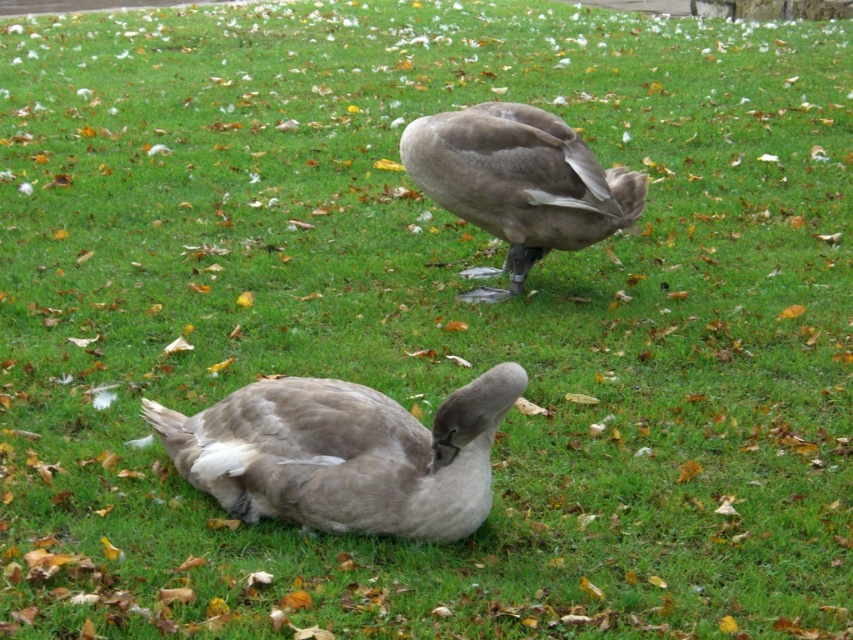
Does point (434, 493) come closer to viewer compared to point (509, 150)?

Yes.

Is the position of gray matte duck at lower left more distant than that of gray matte duck at center?

No, it is not.

Is point (280, 412) positioned behind point (605, 236)?

No, (280, 412) is closer to viewer.

Identify the location of gray matte duck at lower left. This screenshot has height=640, width=853. (344, 454).